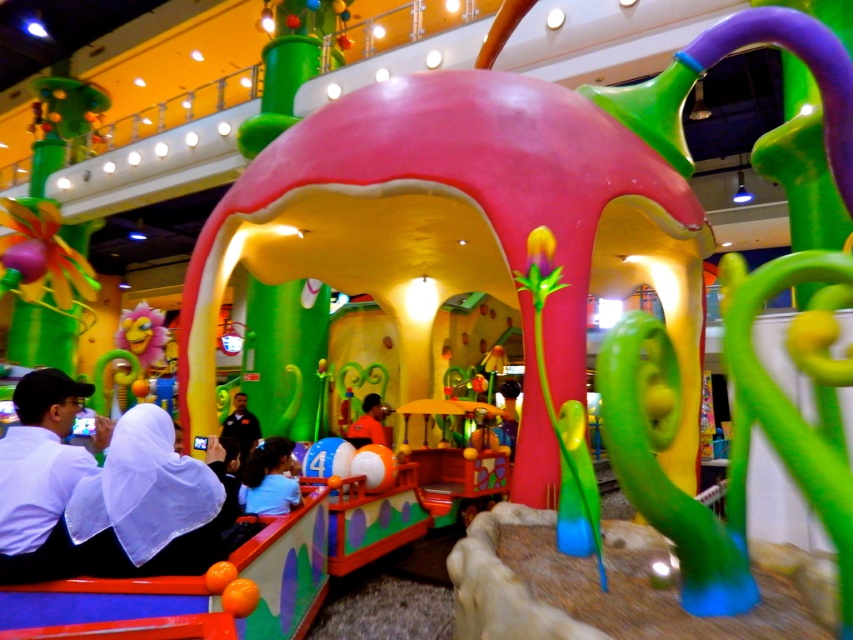
Can you confirm if white matte shirt at center is thinner than black matte shirt at center?

Indeed, white matte shirt at center has a lesser width compared to black matte shirt at center.

Describe the element at coordinates (268, 477) in the screenshot. I see `white matte shirt at center` at that location.

The height and width of the screenshot is (640, 853). Find the location of `white matte shirt at center`. white matte shirt at center is located at coordinates (268, 477).

Which is behind, point (51, 368) or point (277, 468)?

The point (51, 368) is behind.

Measure the distance between white matte shirt at lower left and white matte shirt at center.

white matte shirt at lower left is 1.13 meters from white matte shirt at center.

What do you see at coordinates (39, 477) in the screenshot?
I see `white matte shirt at lower left` at bounding box center [39, 477].

What are the coordinates of `white matte shirt at lower left` in the screenshot? It's located at (39, 477).

Image resolution: width=853 pixels, height=640 pixels. Describe the element at coordinates (268, 477) in the screenshot. I see `white matte shirt at center` at that location.

How much distance is there between white matte shirt at center and orange matte shirt at center?

white matte shirt at center is 2.94 meters away from orange matte shirt at center.

Between point (260, 474) and point (364, 396), which one is positioned in front?

Point (260, 474) is in front.

Where is `white matte shirt at center`? The width and height of the screenshot is (853, 640). white matte shirt at center is located at coordinates (268, 477).